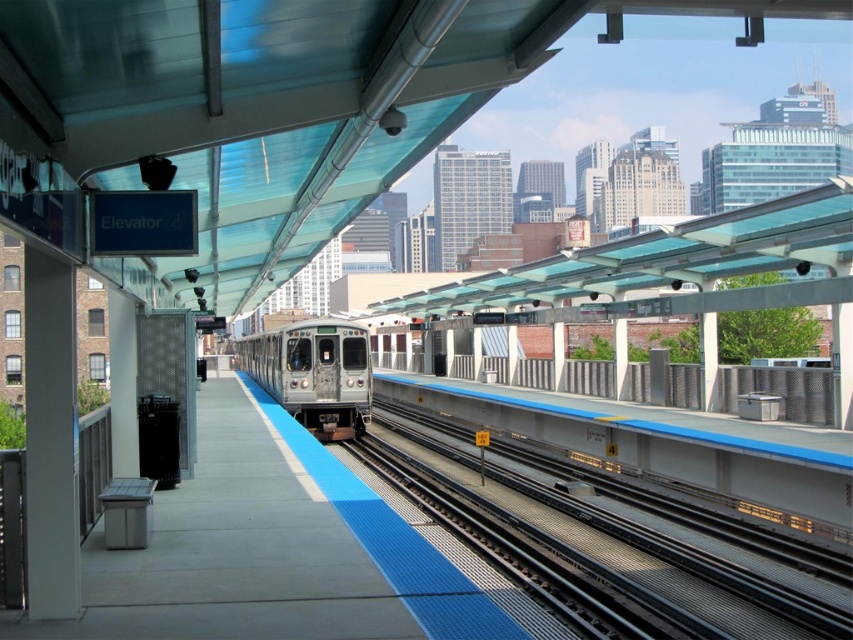
You are a visually impaired passenger standing on the bright blue tactile paving strip at the platform edge. You want to board the silver metallic train at center but need to ensure you don not step onto the metallic gray tracks at center. Based on their positions, which object is closer to you to help you navigate safely?

The metallic gray tracks at center are closer to the viewer than the silver metallic train at center. Therefore, the metallic gray tracks at center are closer to you, so you should avoid stepping towards them and instead move towards the silver metallic train at center which is farther away.

You are a commuter waiting for your train at the train station platform. You notice the metallic gray tracks at center and the silver metallic train at center. Based on their positions, which object is closer to the platform edge?

The silver metallic train at center is closer to the platform edge because the metallic gray tracks at center are positioned to the right of the train, meaning the train is between the tracks and the edge.